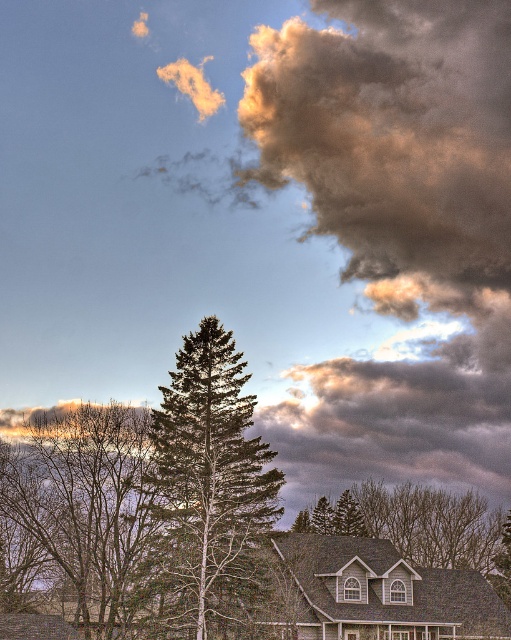
Question: Which object is positioned closest to the green needle-like tree at center?

Choices:
 (A) green matte evergreen tree at center
 (B) brown textured tree at center
 (C) cloudy textured sky at upper right

Answer: (B)

Question: Among these points, which one is nearest to the camera?

Choices:
 (A) (184, 413)
 (B) (154, 488)

Answer: (A)

Question: Is green needle-like tree at center below green matte evergreen tree at center?

Choices:
 (A) no
 (B) yes

Answer: (A)

Question: Does cloudy textured sky at upper right appear on the right side of green needle-like tree at center?

Choices:
 (A) yes
 (B) no

Answer: (A)

Question: Which point is farther to the camera?

Choices:
 (A) (155, 525)
 (B) (318, 529)

Answer: (B)

Question: Does green needle-like tree at center appear over green matte evergreen tree at center?

Choices:
 (A) yes
 (B) no

Answer: (A)